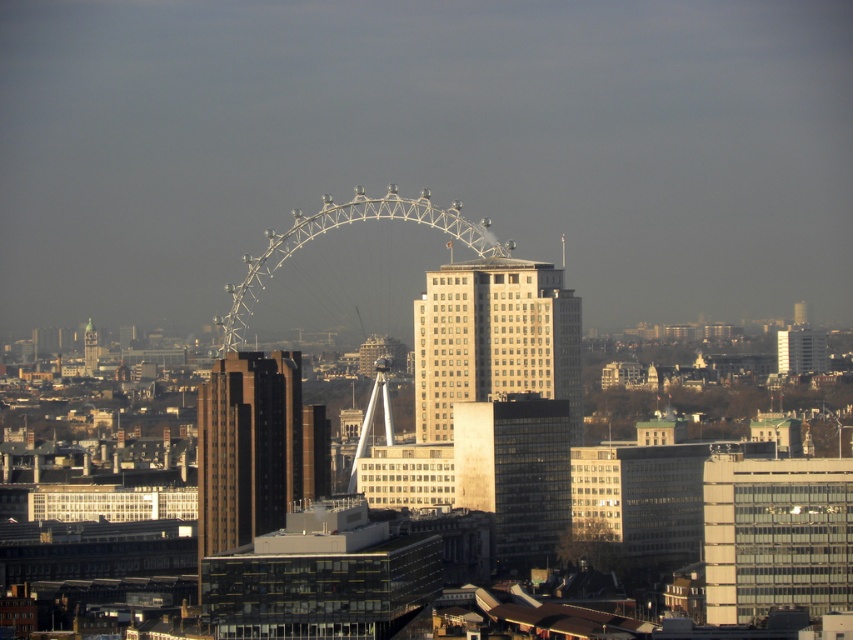
What are the coordinates of the beige glass building at center?

The beige glass building at center is located at coordinates point (494,339).